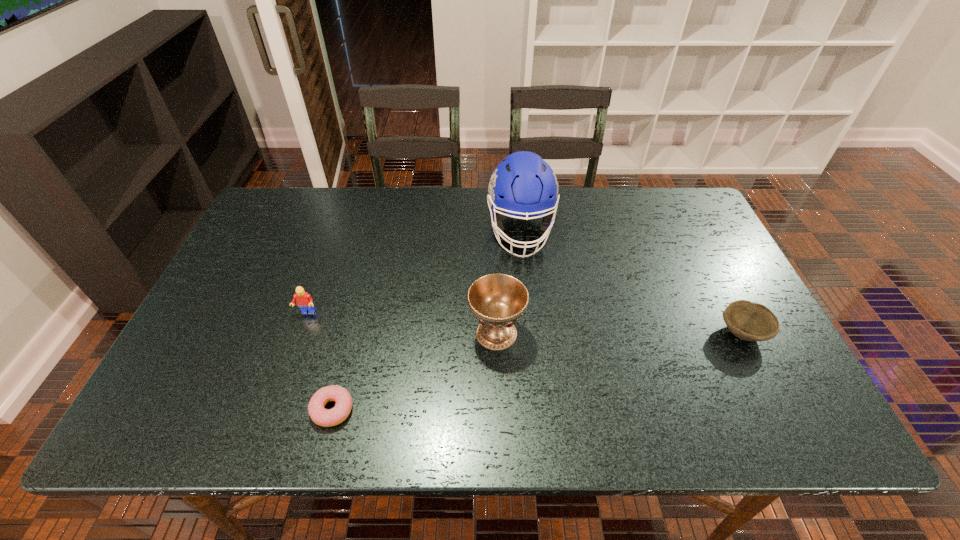
You are a GUI agent. You are given a task and a screenshot of the screen. Output one action in this format:
    pyautogui.click(x=<x>, y=<y>)
    Task: Click on the fourth closest object relative to the fourth shortest object
    This screenshot has height=540, width=960.
    Given the screenshot: What is the action you would take?
    pyautogui.click(x=749, y=321)

Point out which object is positioned as the fourth nearest to the doughnut. Please provide its 2D coordinates. Your answer should be formatted as a tuple, i.e. [(x, y)], where the tuple contains the x and y coordinates of a point satisfying the conditions above.

[(749, 321)]

Locate an element on the screen. free space that satisfies the following two spatial constraints: 1. on the front-facing side of the Lego; 2. on the right side of the second tallest object is located at coordinates (300, 333).

At what (x,y) coordinates should I click in order to perform the action: click on free region that satisfies the following two spatial constraints: 1. on the face guard of the farthest object; 2. on the left side of the bowl. Please return your answer as a coordinate pair (x, y). The width and height of the screenshot is (960, 540). Looking at the image, I should click on (531, 332).

Find the location of `vacant area in the image that satisfies the following two spatial constraints: 1. on the front-facing side of the chalice; 2. on the right side of the leftmost object`. vacant area in the image that satisfies the following two spatial constraints: 1. on the front-facing side of the chalice; 2. on the right side of the leftmost object is located at coordinates (300, 333).

The height and width of the screenshot is (540, 960). What are the coordinates of `vacant space that satisfies the following two spatial constraints: 1. on the back side of the bowl; 2. on the left side of the chalice` in the screenshot? It's located at (496, 332).